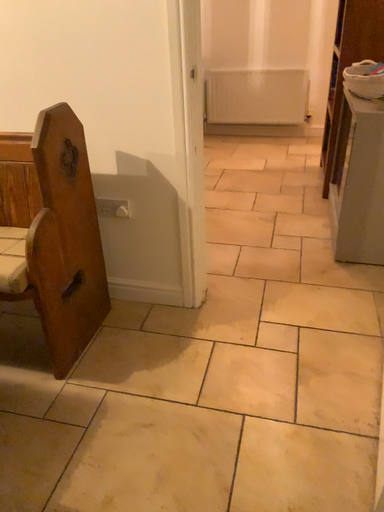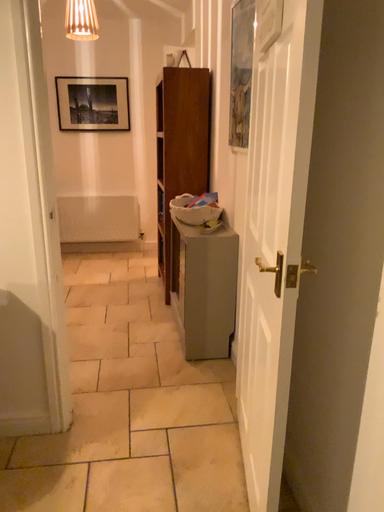
Question: How did the camera likely rotate when shooting the video?

Choices:
 (A) rotated left
 (B) rotated right

Answer: (B)